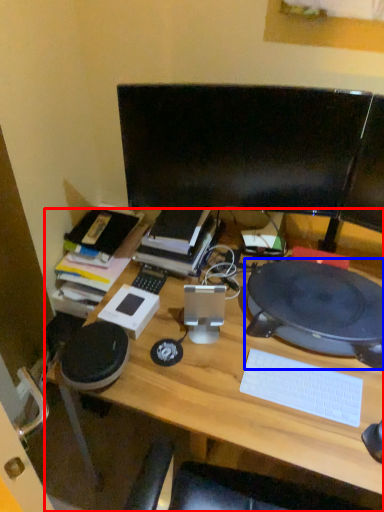
Question: Which object appears closest to the camera in this image, desk (highlighted by a red box) or computer (highlighted by a blue box)?

Choices:
 (A) desk
 (B) computer

Answer: (A)